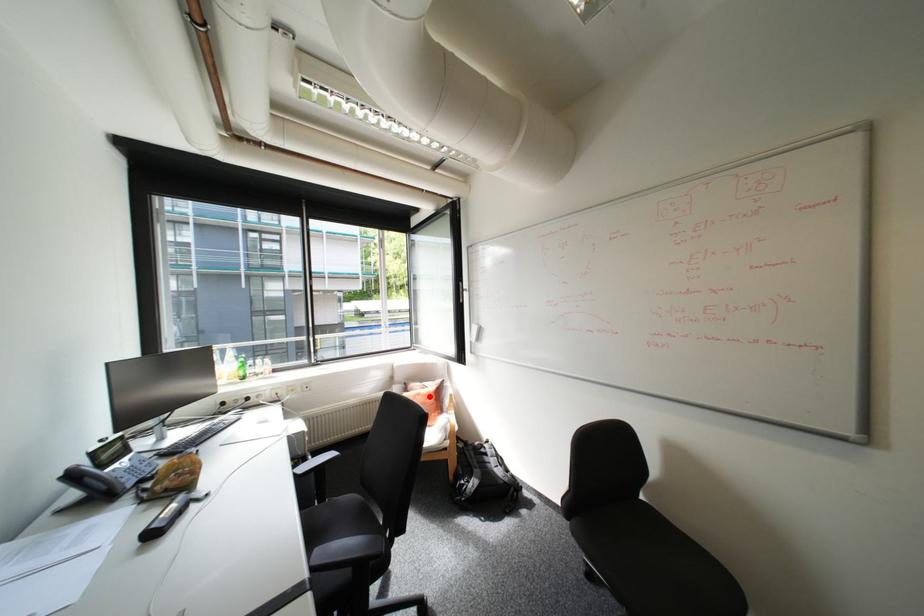
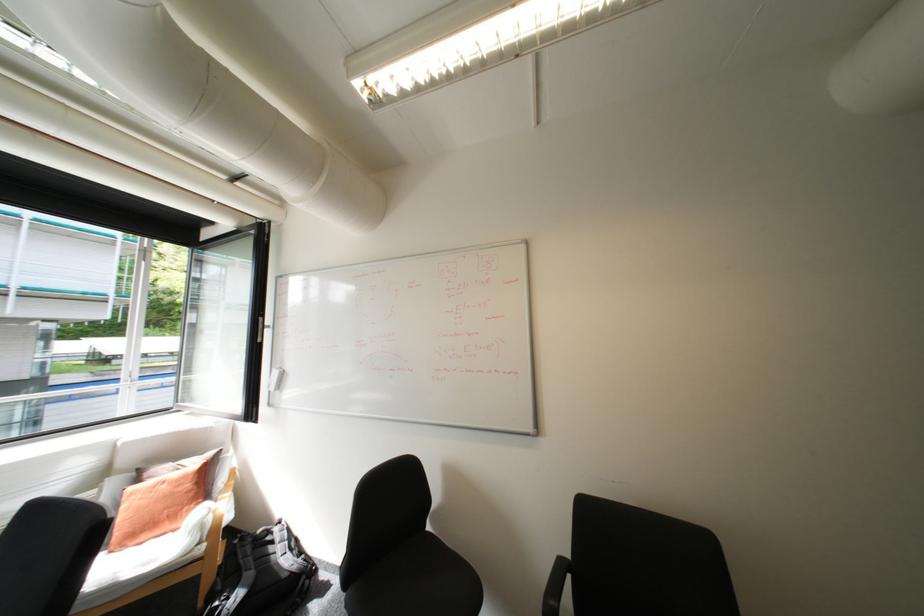
Question: I am providing you with two images of the same scene from different viewpoints. A red point is marked on the first image. At the location where the point appears in image 1, is it still visible in image 2?

Choices:
 (A) Yes
 (B) No

Answer: (A)